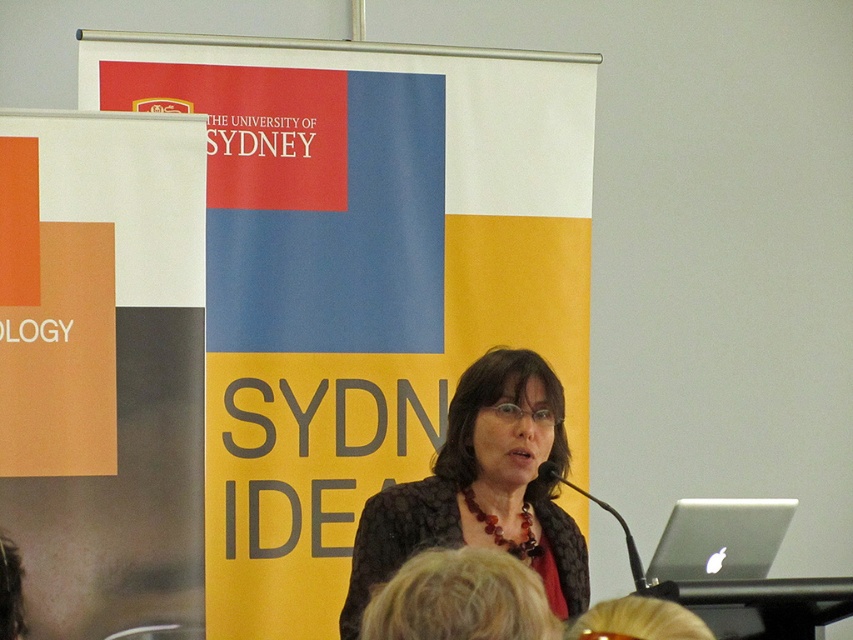
Is matte plastic banner at center below silver metallic laptop at lower right?

Actually, matte plastic banner at center is above silver metallic laptop at lower right.

Between point (381, 76) and point (718, 557), which one is positioned behind?

Positioned behind is point (381, 76).

At what (x,y) coordinates should I click in order to perform the action: click on matte plastic banner at center. Please return your answer as a coordinate pair (x, y). The height and width of the screenshot is (640, 853). Looking at the image, I should click on (358, 273).

What do you see at coordinates (358, 273) in the screenshot?
I see `matte plastic banner at center` at bounding box center [358, 273].

Is matte plastic banner at center thinner than orange matte poster at left?

No.

Locate an element on the screen. This screenshot has width=853, height=640. matte plastic banner at center is located at coordinates (358, 273).

Can you confirm if matte plastic banner at center is positioned to the left of matte black jacket at center?

Indeed, matte plastic banner at center is positioned on the left side of matte black jacket at center.

Does matte plastic banner at center have a lesser width compared to matte black jacket at center?

No.

Does point (215, 246) lie in front of point (491, 516)?

No, it is not.

Locate an element on the screen. matte plastic banner at center is located at coordinates (358, 273).